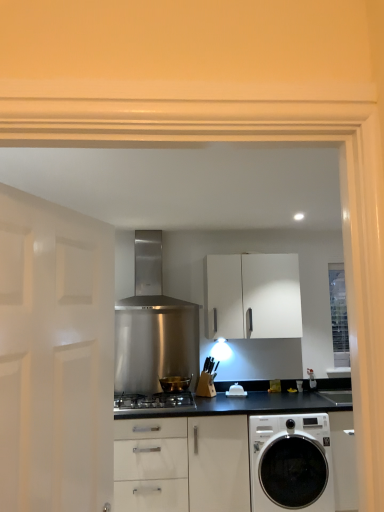
Question: Does white matte cabinet at center have a lesser height compared to stainless steel gas stove at center?

Choices:
 (A) no
 (B) yes

Answer: (A)

Question: From a real-world perspective, is white matte cabinet at center on stainless steel gas stove at center?

Choices:
 (A) yes
 (B) no

Answer: (A)

Question: Is white matte cabinet at center turned away from stainless steel gas stove at center?

Choices:
 (A) yes
 (B) no

Answer: (B)

Question: Is white matte cabinet at center bigger than stainless steel gas stove at center?

Choices:
 (A) no
 (B) yes

Answer: (B)

Question: From the image's perspective, is white matte cabinet at center located beneath stainless steel gas stove at center?

Choices:
 (A) no
 (B) yes

Answer: (A)

Question: Considering the relative positions of white matte cabinet at center and stainless steel gas stove at center in the image provided, is white matte cabinet at center to the right of stainless steel gas stove at center from the viewer's perspective?

Choices:
 (A) yes
 (B) no

Answer: (A)

Question: Does white matte door at left have a smaller size compared to stainless steel range hood at center?

Choices:
 (A) no
 (B) yes

Answer: (B)

Question: From a real-world perspective, does white matte door at left sit lower than stainless steel range hood at center?

Choices:
 (A) no
 (B) yes

Answer: (B)

Question: Is the position of white matte door at left less distant than that of stainless steel range hood at center?

Choices:
 (A) yes
 (B) no

Answer: (A)

Question: From the image's perspective, would you say white matte door at left is shown under stainless steel range hood at center?

Choices:
 (A) no
 (B) yes

Answer: (B)

Question: Can you see white matte door at left touching stainless steel range hood at center?

Choices:
 (A) no
 (B) yes

Answer: (A)

Question: Is white matte door at left not inside stainless steel range hood at center?

Choices:
 (A) no
 (B) yes

Answer: (B)

Question: Is stainless steel range hood at center smaller than clear glass window at right?

Choices:
 (A) yes
 (B) no

Answer: (B)